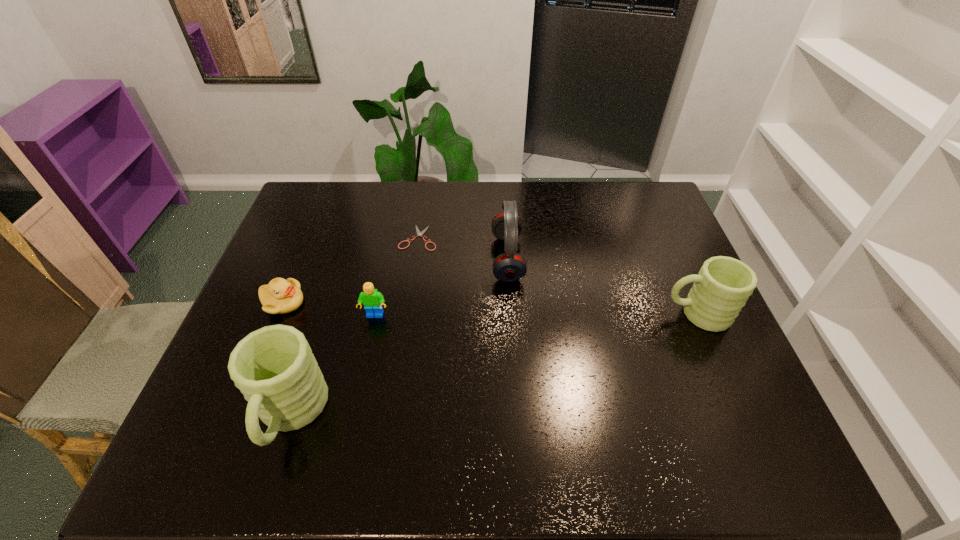
Locate an element on the screen. object at the right edge is located at coordinates (720, 290).

The height and width of the screenshot is (540, 960). Find the location of `object present at the near left corner`. object present at the near left corner is located at coordinates (274, 367).

Locate an element on the screen. vacant space at the far edge of the desktop is located at coordinates (466, 219).

At what (x,y) coordinates should I click in order to perform the action: click on free region at the near edge of the desktop. Please return your answer as a coordinate pair (x, y). Looking at the image, I should click on (678, 405).

Locate an element on the screen. The width and height of the screenshot is (960, 540). vacant area at the left edge of the desktop is located at coordinates (237, 341).

In order to click on free region at the right edge of the desktop in this screenshot , I will do `click(700, 360)`.

The height and width of the screenshot is (540, 960). In the image, there is a desktop. What are the coordinates of `vacant space at the far left corner` in the screenshot? It's located at (326, 212).

Find the location of a particular element. vacant space at the near left corner of the desktop is located at coordinates (204, 402).

This screenshot has width=960, height=540. Identify the location of free location at the far right corner. (637, 195).

What are the coordinates of `empty location between the rightmost object and the Lego` in the screenshot? It's located at (536, 315).